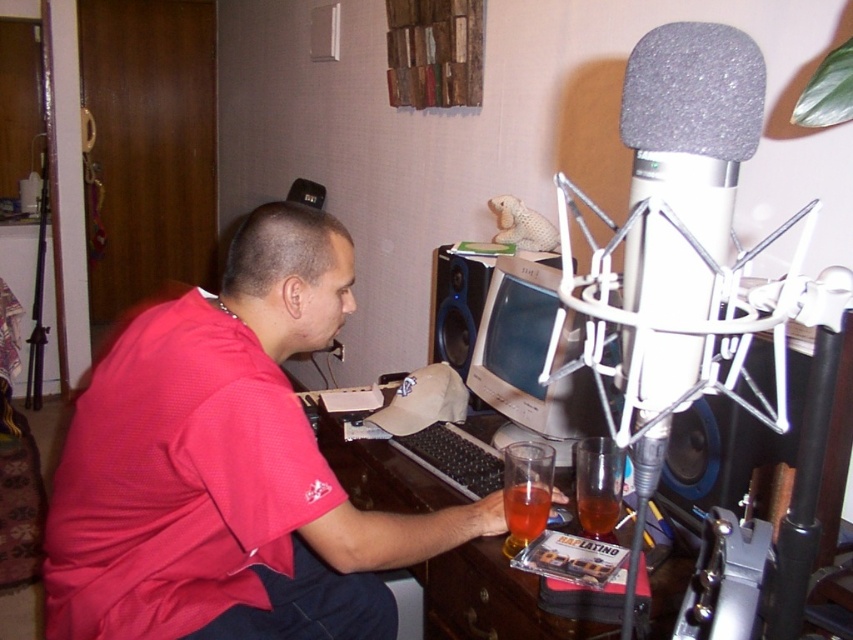
Where is `white matte microphone at upper right`? The height and width of the screenshot is (640, 853). white matte microphone at upper right is located at coordinates (692, 122).

Is point (730, 128) more distant than point (589, 516)?

No, it is not.

Image resolution: width=853 pixels, height=640 pixels. Identify the location of white matte microphone at upper right. (692, 122).

Does red mesh polo shirt at left have a greater height compared to matte gray monitor at center?

Yes.

Is point (263, 513) in front of point (554, 444)?

Yes, it is.

This screenshot has width=853, height=640. I want to click on red mesh polo shirt at left, so click(x=177, y=481).

Find the location of `black matte speaker at center`. black matte speaker at center is located at coordinates (724, 449).

Is black matte speaker at center below black plastic speaker at center?

Yes, black matte speaker at center is below black plastic speaker at center.

Find the location of a particular element. black matte speaker at center is located at coordinates click(724, 449).

Locate an element on the screen. black matte speaker at center is located at coordinates (724, 449).